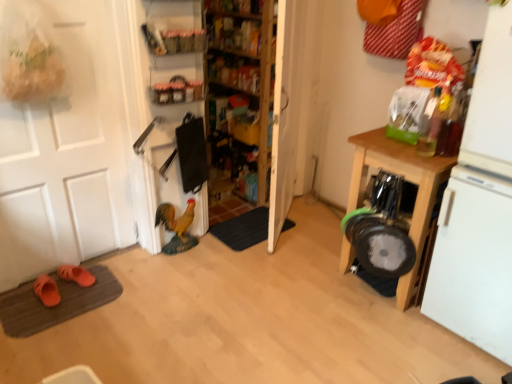
Question: Does dark gray carpet at center, placed as the 2th doormat when sorted from bottom to top, come behind matte plastic shelf at upper center, which ranks as the first shelf in front-to-back order?

Choices:
 (A) no
 (B) yes

Answer: (B)

Question: Is dark gray carpet at center, which ranks as the second doormat in front-to-back order, looking in the opposite direction of matte plastic shelf at upper center, which is counted as the 3th shelf, starting from the back?

Choices:
 (A) yes
 (B) no

Answer: (B)

Question: Considering the relative sizes of dark gray carpet at center, positioned as the first doormat in top-to-bottom order, and matte plastic shelf at upper center, which ranks as the first shelf in front-to-back order, in the image provided, is dark gray carpet at center, positioned as the first doormat in top-to-bottom order, shorter than matte plastic shelf at upper center, which ranks as the first shelf in front-to-back order,?

Choices:
 (A) yes
 (B) no

Answer: (A)

Question: Is matte plastic shelf at upper center, which is counted as the 3th shelf, starting from the back, completely or partially inside dark gray carpet at center, which ranks as the second doormat in front-to-back order?

Choices:
 (A) no
 (B) yes

Answer: (A)

Question: From the image's perspective, is dark gray carpet at center, placed as the first doormat when sorted from back to front, beneath matte plastic shelf at upper center, which ranks as the first shelf in front-to-back order?

Choices:
 (A) no
 (B) yes

Answer: (B)

Question: Is white matte refrigerator at right inside or outside of orange suede slippers at lower left, which is the 2th footwear from front to back?

Choices:
 (A) inside
 (B) outside

Answer: (B)

Question: From a real-world perspective, is white matte refrigerator at right physically located above or below orange suede slippers at lower left, the 1th footwear viewed from the back?

Choices:
 (A) below
 (B) above

Answer: (B)

Question: In terms of size, does white matte refrigerator at right appear bigger or smaller than orange suede slippers at lower left, which is the 2th footwear from front to back?

Choices:
 (A) small
 (B) big

Answer: (B)

Question: Would you say white matte refrigerator at right is to the left or to the right of orange suede slippers at lower left, the 1th footwear viewed from the back, in the picture?

Choices:
 (A) left
 (B) right

Answer: (B)

Question: Visually, is brown textured doormat at lower left, which is the 1th doormat from left to right, positioned to the left or to the right of white matte door at left?

Choices:
 (A) left
 (B) right

Answer: (A)

Question: From the image's perspective, is brown textured doormat at lower left, acting as the 2th doormat starting from the right, located above or below white matte door at left?

Choices:
 (A) below
 (B) above

Answer: (A)

Question: Is brown textured doormat at lower left, arranged as the 2th doormat when viewed from the top, wider or thinner than white matte door at left?

Choices:
 (A) wide
 (B) thin

Answer: (A)

Question: Looking at the image, does brown textured doormat at lower left, the 1th doormat when ordered from bottom to top, seem bigger or smaller compared to white matte door at left?

Choices:
 (A) big
 (B) small

Answer: (B)

Question: Considering the relative positions of white matte door at left and dark gray carpet at center, which is the 2th doormat from left to right, in the image provided, is white matte door at left to the left or to the right of dark gray carpet at center, which is the 2th doormat from left to right,?

Choices:
 (A) left
 (B) right

Answer: (A)

Question: From a real-world perspective, relative to dark gray carpet at center, which is the 2th doormat from left to right, is white matte door at left vertically above or below?

Choices:
 (A) above
 (B) below

Answer: (A)